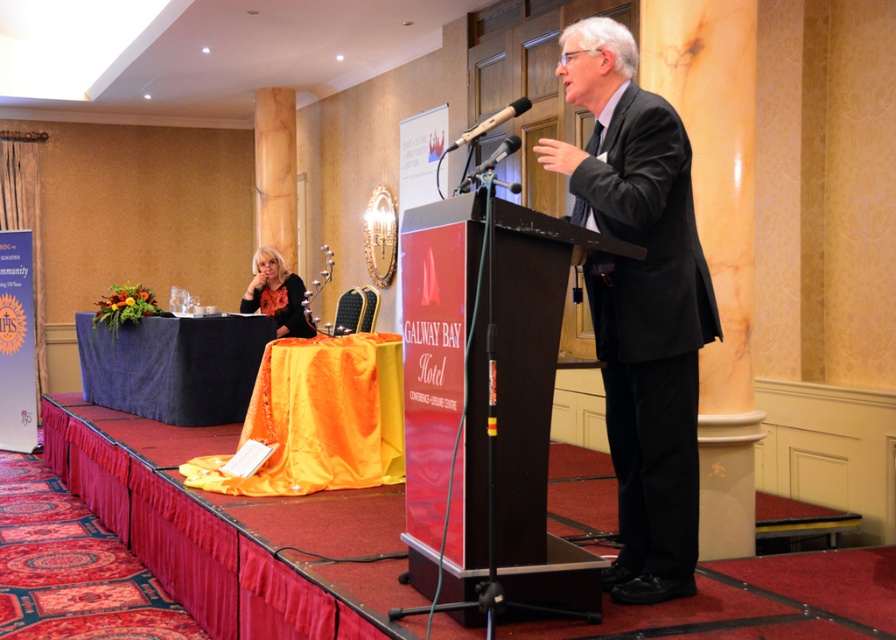
Question: Which object is positioned closest to the matte black podium at center?

Choices:
 (A) metallic silver microphone at center
 (B) matte orange dress at lower left
 (C) black plastic microphone at center
 (D) velvet blue tablecloth at left

Answer: (A)

Question: Which object is farther from the camera taking this photo?

Choices:
 (A) metallic silver microphone at center
 (B) velvet blue tablecloth at left

Answer: (B)

Question: Can you confirm if velvet blue tablecloth at left is thinner than matte orange dress at lower left?

Choices:
 (A) no
 (B) yes

Answer: (A)

Question: Among these points, which one is nearest to the camera?

Choices:
 (A) (625, 440)
 (B) (468, 426)

Answer: (B)

Question: Is velvet blue tablecloth at left thinner than metallic silver microphone at center?

Choices:
 (A) no
 (B) yes

Answer: (A)

Question: Can you confirm if black suit at center is positioned to the right of black plastic microphone at center?

Choices:
 (A) no
 (B) yes

Answer: (B)